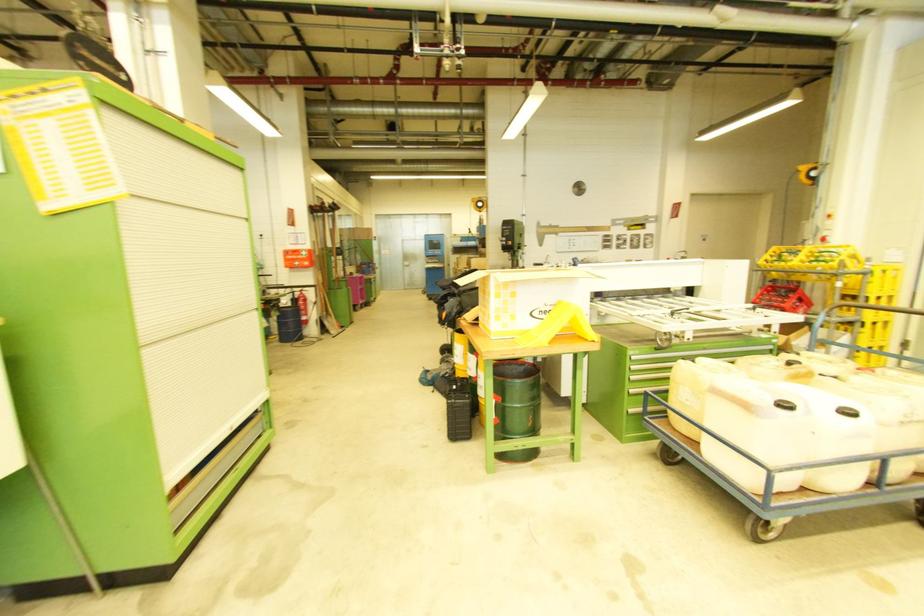
Locate an element on the screen. The width and height of the screenshot is (924, 616). green drawer handle is located at coordinates (695, 354).